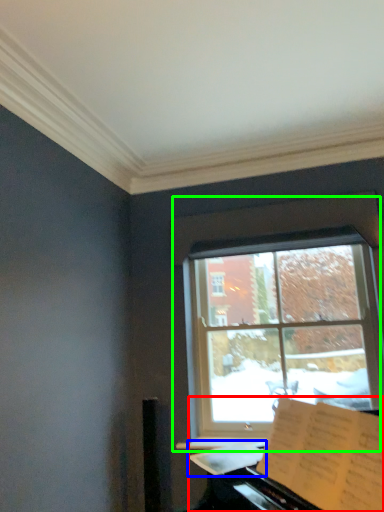
Question: Which object is the closest to the piano (highlighted by a red box)? Choose among these: sheet music (highlighted by a blue box) or window (highlighted by a green box).

Choices:
 (A) sheet music
 (B) window

Answer: (A)